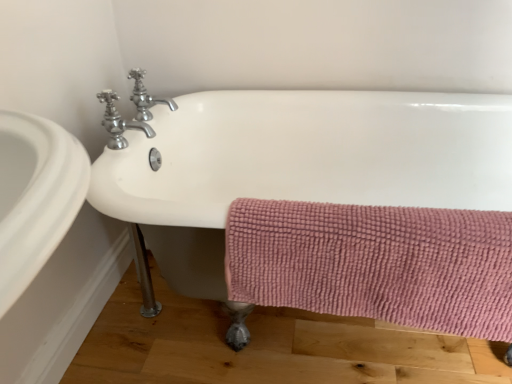
This screenshot has width=512, height=384. I want to click on blank space situated above pink textured towel at lower right (from a real-world perspective), so click(397, 214).